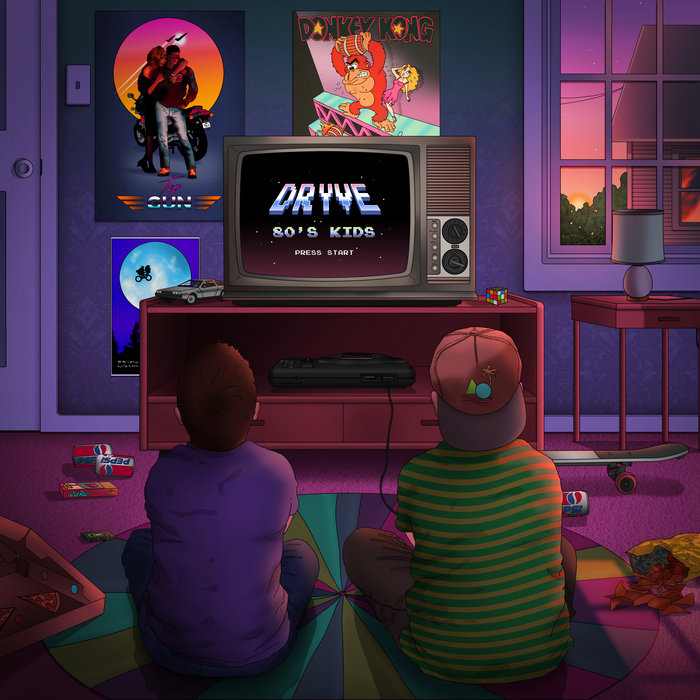
Where is `door`? door is located at coordinates 21,99.